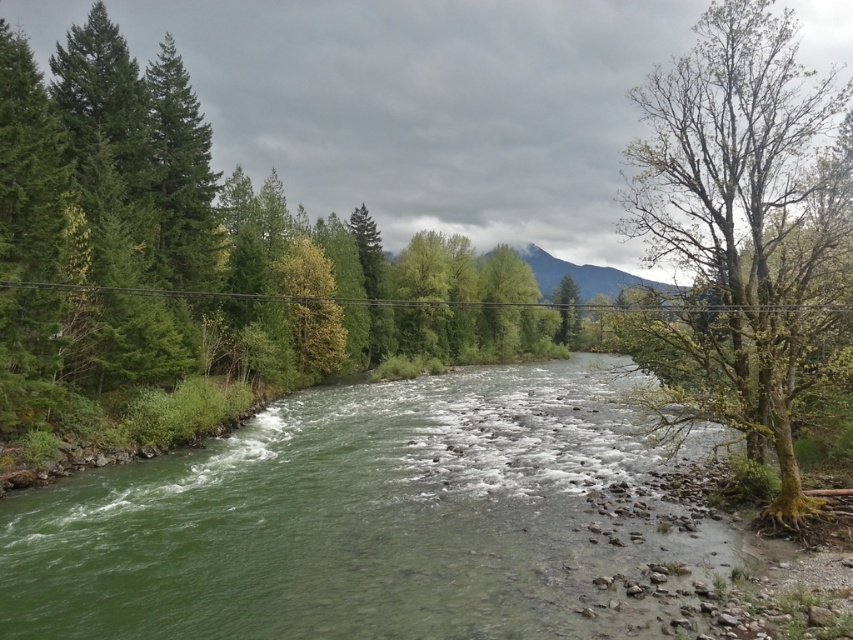
Measure the distance between green smooth river at center and camera.

green smooth river at center is 10.21 meters from camera.

Can you confirm if green smooth river at center is smaller than green mossy tree at right?

Indeed, green smooth river at center has a smaller size compared to green mossy tree at right.

Is point (54, 538) positioned in front of point (669, 323)?

Yes, point (54, 538) is closer to viewer.

Locate an element on the screen. Image resolution: width=853 pixels, height=640 pixels. green smooth river at center is located at coordinates (338, 516).

Is green smooth river at center to the left of green leafy tree at center from the viewer's perspective?

Correct, you'll find green smooth river at center to the left of green leafy tree at center.

Who is more distant from viewer, (524, 387) or (575, 332)?

The point (575, 332) is more distant.

Where is `green smooth river at center`? This screenshot has height=640, width=853. green smooth river at center is located at coordinates (338, 516).

Measure the distance between point (647,221) and camera.

They are 18.71 meters apart.

Between point (793, 42) and point (572, 316), which one is positioned in front?

Positioned in front is point (572, 316).

Consider the image. Measure the distance between point (785, 275) and camera.

Point (785, 275) and camera are 51.70 feet apart.

Where is `green mossy tree at right`? green mossy tree at right is located at coordinates click(746, 230).